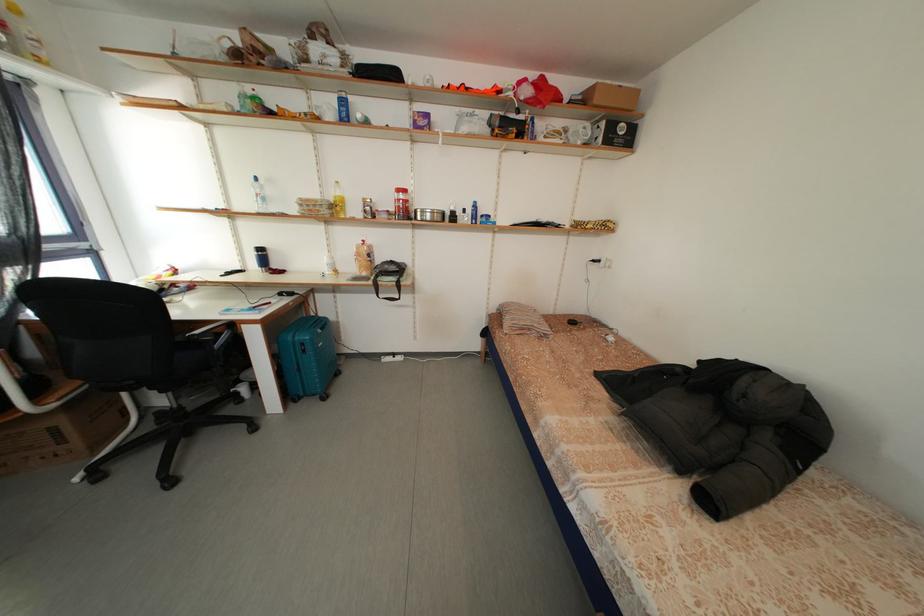
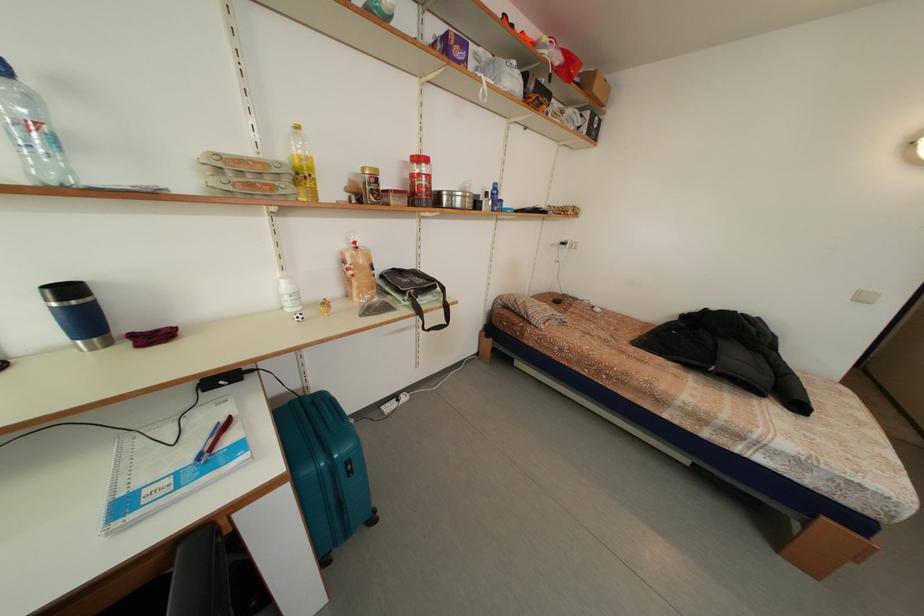
The point at (403, 289) is marked in the first image. Where is the corresponding point in the second image?

(448, 310)